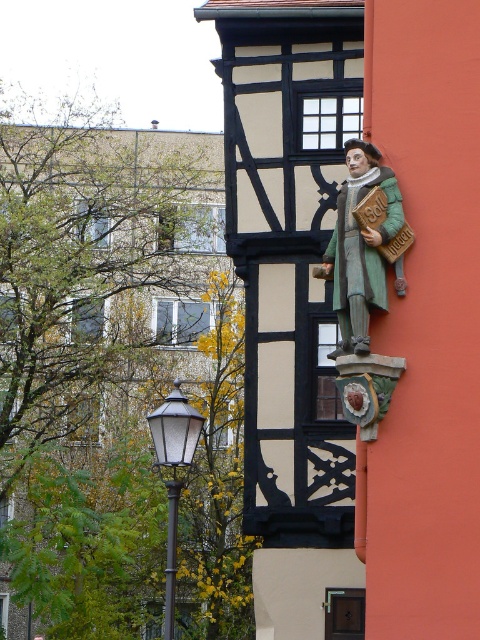
Between matte black lamp post at lower left and metallic pole at lower left, which one is positioned higher?

matte black lamp post at lower left is above.

Is matte black lamp post at lower left further to camera compared to metallic pole at lower left?

No, it is not.

This screenshot has height=640, width=480. In order to click on matte black lamp post at lower left in this screenshot , I will do `click(173, 472)`.

Where is `matte black lamp post at lower left`? matte black lamp post at lower left is located at coordinates (173, 472).

Describe the element at coordinates (361, 246) in the screenshot. This screenshot has height=640, width=480. I see `green carved wood figure at center` at that location.

Between point (336, 273) and point (165, 440), which one is positioned behind?

The point (165, 440) is behind.

Locate an element on the screen. green carved wood figure at center is located at coordinates (361, 246).

Is point (365, 323) closer to camera compared to point (168, 547)?

Yes, it is.

Between point (346, 273) and point (166, 577), which one is positioned behind?

Point (166, 577)

Does point (348, 250) lie behind point (167, 632)?

No, (348, 250) is closer to viewer.

Locate an element on the screen. green carved wood figure at center is located at coordinates (361, 246).